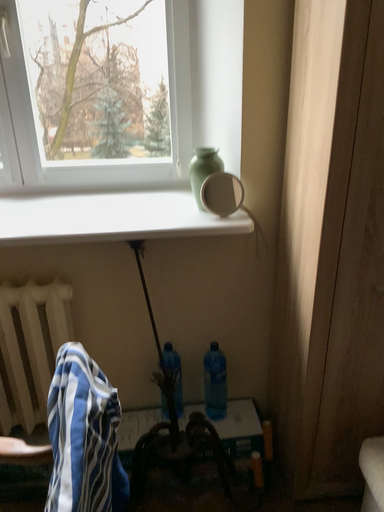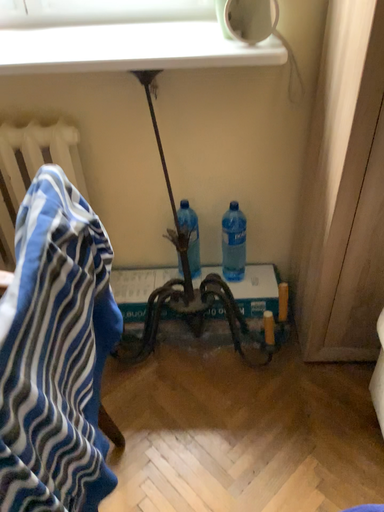
Question: How did the camera likely rotate when shooting the video?

Choices:
 (A) rotated upward
 (B) rotated downward

Answer: (B)